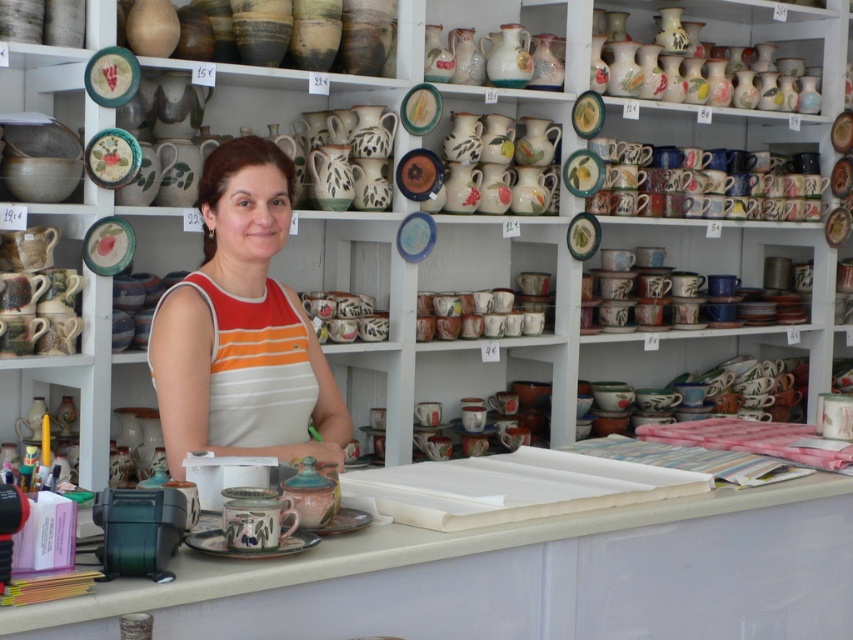
Between matte ceramic vases at upper right and matte ceramic vases at upper center, which one is positioned higher?

matte ceramic vases at upper right is higher up.

The width and height of the screenshot is (853, 640). What do you see at coordinates (784, 35) in the screenshot?
I see `matte ceramic vases at upper right` at bounding box center [784, 35].

Does point (822, 13) come in front of point (554, 29)?

No, it is behind (554, 29).

The height and width of the screenshot is (640, 853). In order to click on matte ceramic vases at upper right in this screenshot , I will do `click(784, 35)`.

Is orange striped tank top at center shorter than matte ceramic vases at upper center?

No, orange striped tank top at center is not shorter than matte ceramic vases at upper center.

Which is more to the right, orange striped tank top at center or matte ceramic vases at upper center?

matte ceramic vases at upper center

This screenshot has width=853, height=640. I want to click on orange striped tank top at center, so click(242, 326).

Identify the location of orange striped tank top at center. (242, 326).

Is orange striped tank top at center wider than matte ceramic vases at upper right?

No.

Which is more to the left, orange striped tank top at center or matte ceramic vases at upper right?

Positioned to the left is orange striped tank top at center.

This screenshot has width=853, height=640. What are the coordinates of `orange striped tank top at center` in the screenshot? It's located at (242, 326).